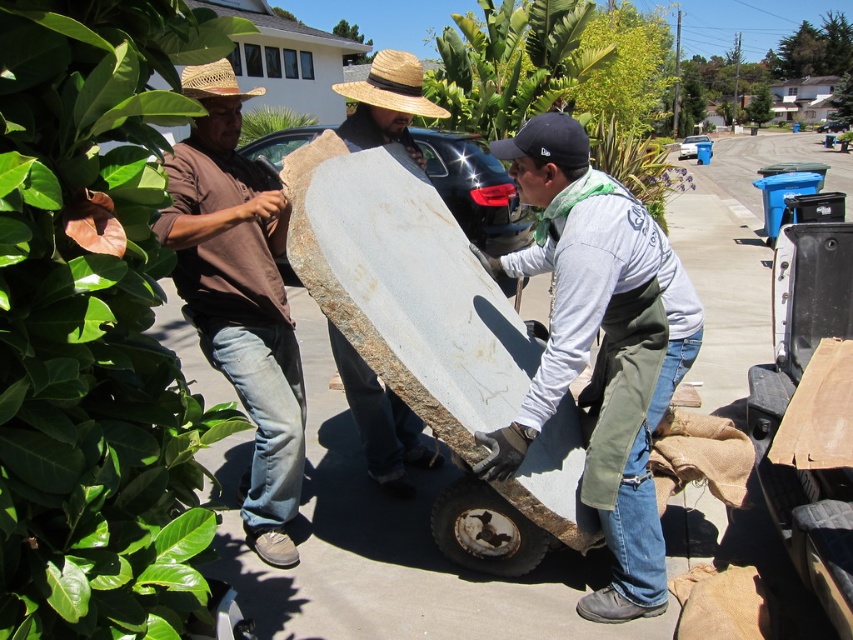
Question: Which object appears closest to the camera in this image?

Choices:
 (A) brown cotton shirt at left
 (B) strawhat at left
 (C) matte concrete slab at center

Answer: (B)

Question: Can you confirm if brown cotton shirt at left is bigger than matte concrete slab at center?

Choices:
 (A) no
 (B) yes

Answer: (B)

Question: Is matte gray concrete at center bigger than strawhat at upper center?

Choices:
 (A) no
 (B) yes

Answer: (B)

Question: Which object is the closest to the brown cotton shirt at left?

Choices:
 (A) matte gray concrete at center
 (B) strawhat at upper center
 (C) matte concrete slab at center

Answer: (C)

Question: Is matte gray concrete at center above matte concrete slab at center?

Choices:
 (A) no
 (B) yes

Answer: (B)

Question: Considering the real-world distances, which object is farthest from the matte gray concrete at center?

Choices:
 (A) strawhat at left
 (B) matte concrete slab at center

Answer: (A)